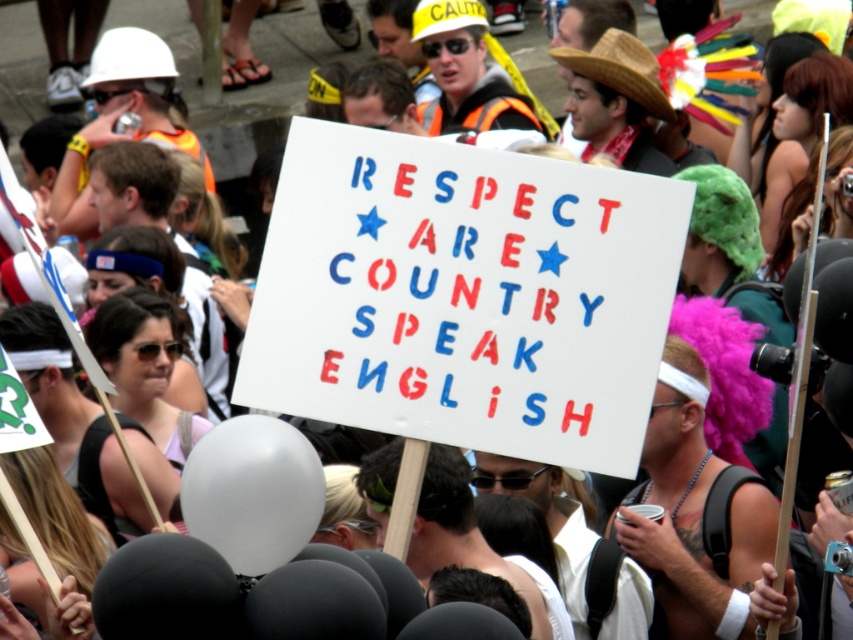
Question: Is white paper sign at center closer to the viewer compared to white matte balloon at center?

Choices:
 (A) no
 (B) yes

Answer: (A)

Question: Which of the following is the closest to the observer?

Choices:
 (A) [x=206, y=483]
 (B) [x=294, y=257]

Answer: (A)

Question: Is white paper sign at center positioned at the back of white matte balloon at center?

Choices:
 (A) no
 (B) yes

Answer: (B)

Question: Can you confirm if white paper sign at center is thinner than white matte balloon at center?

Choices:
 (A) yes
 (B) no

Answer: (B)